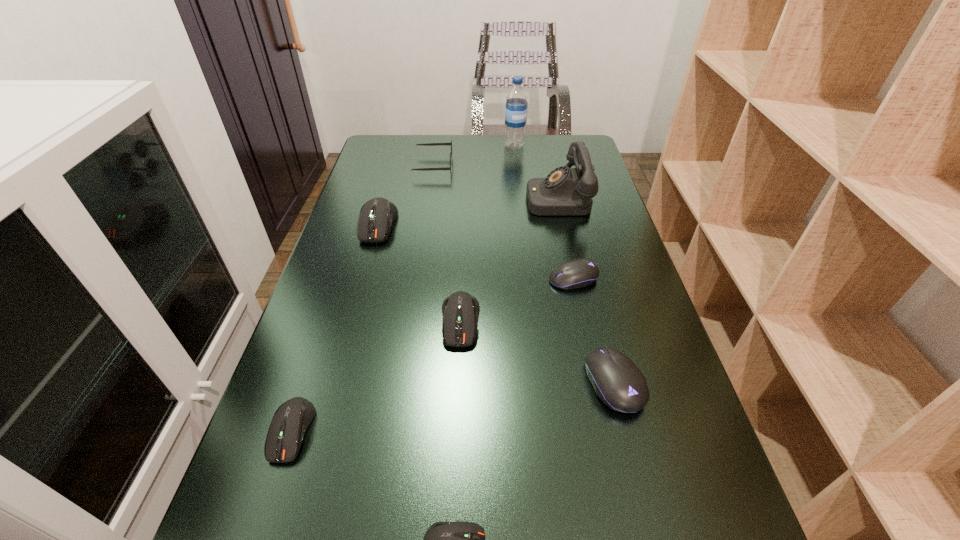
You are a GUI agent. You are given a task and a screenshot of the screen. Output one action in this format:
    pyautogui.click(x=<x>, y=<y>)
    Task: Click on the vacant space at the right edge of the desktop
    This screenshot has width=960, height=540.
    Given the screenshot: What is the action you would take?
    [x=588, y=221]

At what (x,y) coordinates should I click in order to perform the action: click on vacant space at the far left corner of the desktop. Please return your answer as a coordinate pair (x, y). The width and height of the screenshot is (960, 540). Looking at the image, I should click on (396, 167).

Where is `vacant space at the far right corner of the desktop`? The image size is (960, 540). vacant space at the far right corner of the desktop is located at coordinates (583, 137).

Locate an element on the screen. The height and width of the screenshot is (540, 960). empty space that is in between the seventh object from right to left and the gray telephone is located at coordinates [x=495, y=181].

The width and height of the screenshot is (960, 540). Find the location of `unoccupied area between the farther black computer mouse and the farthest dark computer equipment`. unoccupied area between the farther black computer mouse and the farthest dark computer equipment is located at coordinates (475, 252).

This screenshot has width=960, height=540. I want to click on empty location between the fifth nearest object and the second nearest dark computer equipment, so click(x=433, y=355).

Identify the location of free point between the second farthest dark computer equipment and the bigger black computer mouse. (538, 352).

You are a GUI agent. You are given a task and a screenshot of the screen. Output one action in this format:
    pyautogui.click(x=<x>, y=<y>)
    Task: Click on the vacant area that lies between the third farthest dark computer equipment and the gray telephone
    
    Given the screenshot: What is the action you would take?
    pyautogui.click(x=424, y=314)

Locate an element on the screen. The width and height of the screenshot is (960, 540). free area in between the farther black computer mouse and the biggest dark computer equipment is located at coordinates (475, 252).

This screenshot has width=960, height=540. Identify the location of unoccupied position between the third nearest dark computer equipment and the bigger black computer mouse. (538, 352).